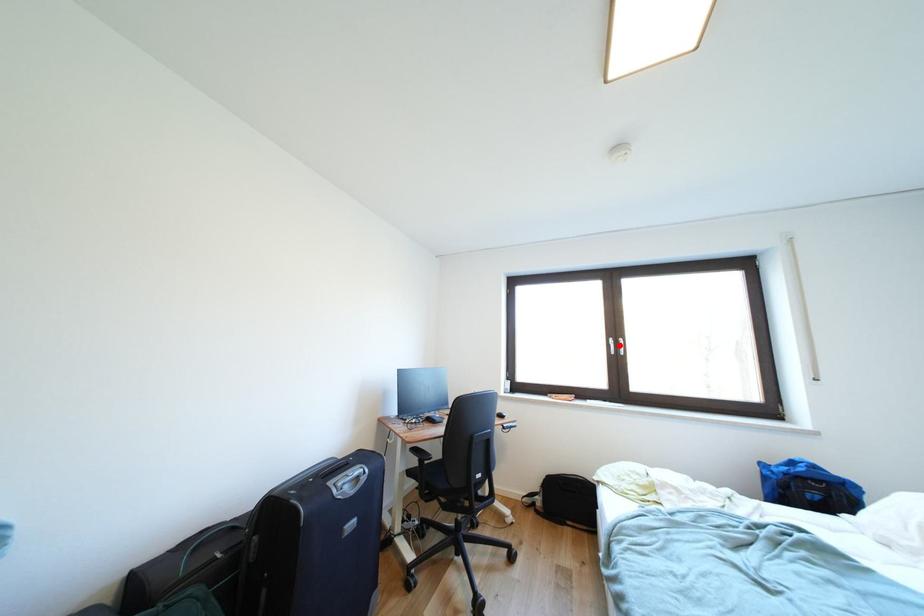
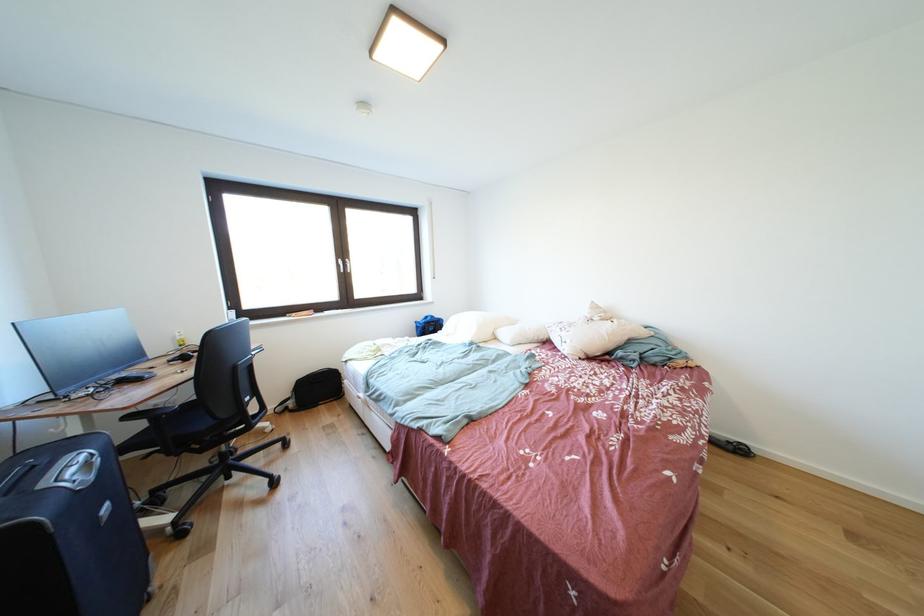
Question: I am providing you with two images of the same scene from different viewpoints. A red point is marked on the first image. Can you still see the location of the red point in image 2?

Choices:
 (A) Yes
 (B) No

Answer: (A)